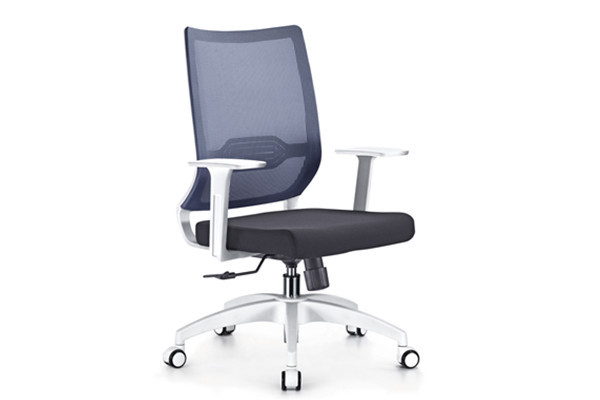
Locate an element on the screen. Image resolution: width=600 pixels, height=400 pixels. 1 chair back is located at coordinates (240, 80).